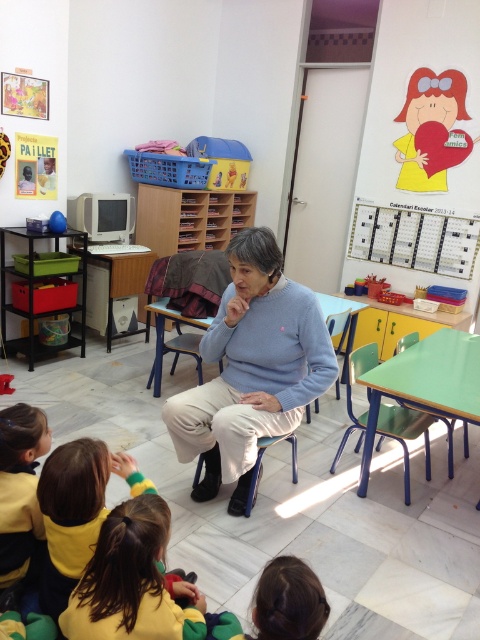
Does light blue sweater at center have a lesser width compared to blue metal chair at lower center?

No.

Is light blue sweater at center to the right of blue metal chair at lower center from the viewer's perspective?

No, light blue sweater at center is not to the right of blue metal chair at lower center.

The image size is (480, 640). I want to click on light blue sweater at center, so click(252, 369).

Looking at this image, can you confirm if light blue sweater at center is wider than yellow-green sweater at lower left?

Yes.

Is light blue sweater at center smaller than yellow-green sweater at lower left?

Incorrect, light blue sweater at center is not smaller in size than yellow-green sweater at lower left.

Is point (269, 289) positioned after point (117, 586)?

Yes.

This screenshot has width=480, height=640. Find the location of `light blue sweater at center`. light blue sweater at center is located at coordinates (252, 369).

Between yellow-green sweater at lower left and light blue fabric chair at center, which one has less height?

With less height is light blue fabric chair at center.

Does point (151, 552) come behind point (340, 339)?

That is False.

Measure the distance between point (176, 632) and camera.

Point (176, 632) and camera are 4.50 feet apart from each other.

Locate an element on the screen. yellow-green sweater at lower left is located at coordinates (127, 579).